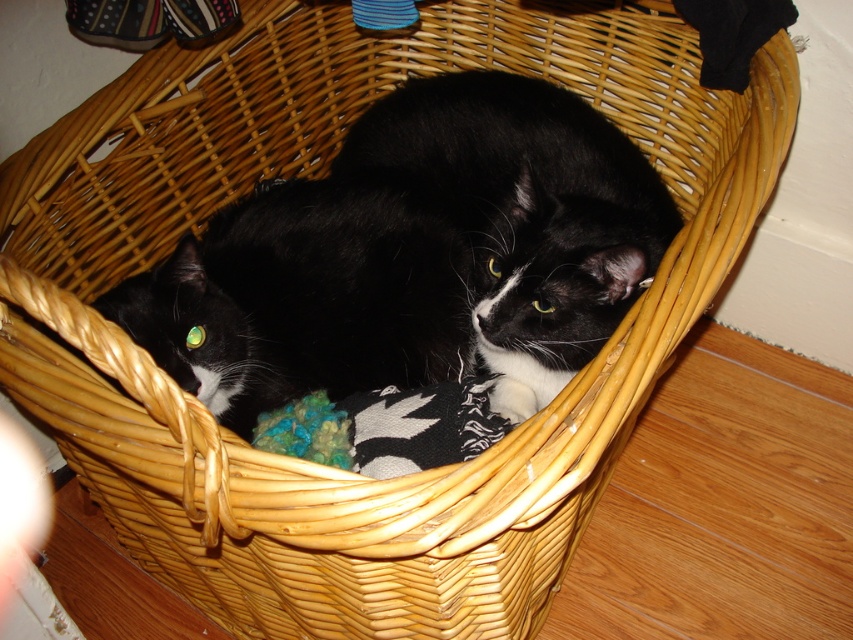
You are a toy designer observing the image. You need to create a storage container for the multicolored yarn ball at center that can also accommodate the black fur cat at center. What should you consider about their sizes?

The black fur cat at center is taller than the multicolored yarn ball at center, so the storage container must be tall enough to accommodate the cat while still holding the yarn ball.

You are a cat owner who wants to retrieve the multicolored yarn ball at center from the basket where the black fur cat at center is resting. Can you safely reach the yarn ball without disturbing the cat?

The black fur cat at center is in front of the multicolored yarn ball at center, so you can carefully reach around the cat to access the yarn ball without disturbing it.